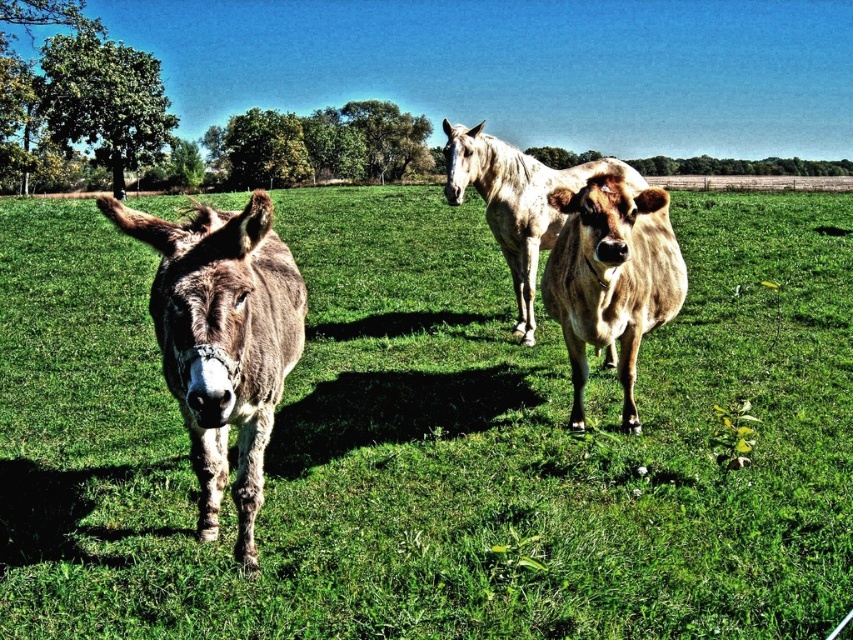
You are a farmer checking the field. You need to know the size of the green grass at center and brown smooth cow at center. Can you tell me which one is wider?

The green grass at center is wider than the brown smooth cow at center according to the description.

Based on the photo, you are a farmer trying to locate your cow in the field. The field is divided into a grid with coordinates from 0 to 1 on both the x and y axes. According to the image, where exactly is the brown smooth cow at center located?

The brown smooth cow at center is located at coordinates point [611,278].